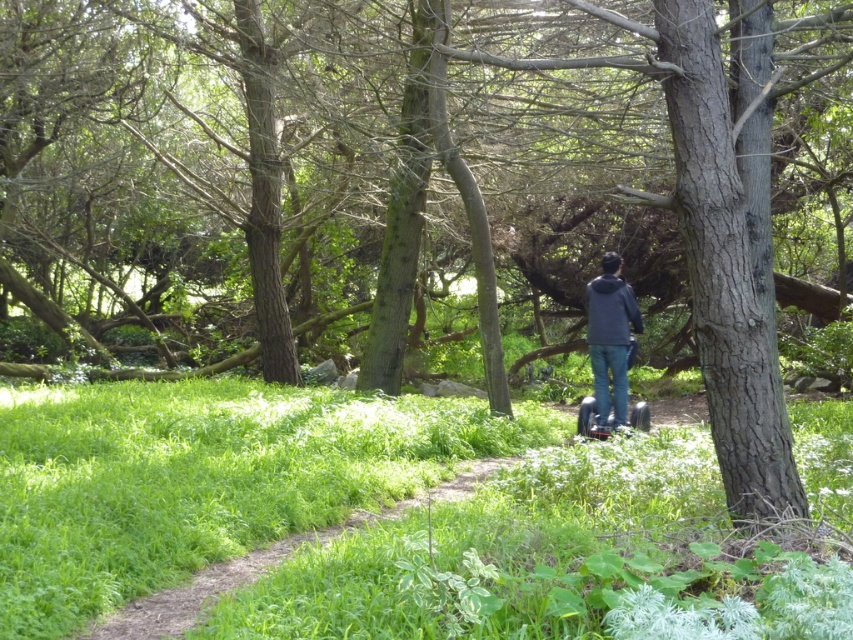
Is green grass at center to the right of metallic silver scooter at center from the viewer's perspective?

In fact, green grass at center is to the left of metallic silver scooter at center.

Is point (132, 404) closer to viewer compared to point (643, 401)?

That is True.

Who is more forward, [18,576] or [584,412]?

Point [18,576] is more forward.

Identify the location of green grass at center. (201, 477).

Which is in front, point (589, 348) or point (643, 417)?

Point (643, 417) is in front.

Who is lower down, dark gray hoodie at center or metallic silver scooter at center?

metallic silver scooter at center is below.

Where is `dark gray hoodie at center`? dark gray hoodie at center is located at coordinates (610, 337).

Between green grass at center and dark gray hoodie at center, which one appears on the left side from the viewer's perspective?

Positioned to the left is green grass at center.

Between point (108, 460) and point (614, 316), which one is positioned in front?

Point (108, 460) is in front.

Where is `green grass at center`? green grass at center is located at coordinates (201, 477).